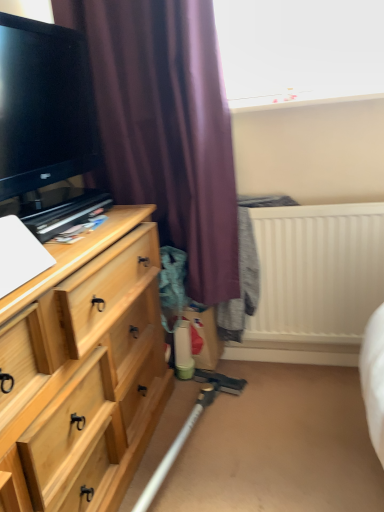
Where is `white plastic radiator at upper right`? white plastic radiator at upper right is located at coordinates (317, 272).

You are a GUI agent. You are given a task and a screenshot of the screen. Output one action in this format:
    pyautogui.click(x=<x>, y=<y>)
    Task: Click on the light wood chest of drawers at left
    The image size is (384, 512).
    Given the screenshot: What is the action you would take?
    pyautogui.click(x=86, y=380)

Identify the location of black glossy tv at left. (44, 106).

Considering the sizes of objects light wood chest of drawers at left and purple matte curtain at upper left in the image provided, who is smaller, light wood chest of drawers at left or purple matte curtain at upper left?

Smaller between the two is purple matte curtain at upper left.

Which object is positioned more to the right, light wood chest of drawers at left or purple matte curtain at upper left?

From the viewer's perspective, purple matte curtain at upper left appears more on the right side.

Is light wood chest of drawers at left positioned behind purple matte curtain at upper left?

That is False.

From the image's perspective, which object appears higher, light wood chest of drawers at left or purple matte curtain at upper left?

purple matte curtain at upper left is shown above in the image.

Considering the relative positions of white plastic radiator at upper right and black glossy tv at left in the image provided, is white plastic radiator at upper right to the right of black glossy tv at left from the viewer's perspective?

Yes, white plastic radiator at upper right is to the right of black glossy tv at left.

Which is in front, white plastic radiator at upper right or black glossy tv at left?

black glossy tv at left is in front.

Considering the relative sizes of white plastic radiator at upper right and black glossy tv at left in the image provided, is white plastic radiator at upper right shorter than black glossy tv at left?

In fact, white plastic radiator at upper right may be taller than black glossy tv at left.

Is white plastic radiator at upper right situated inside black glossy tv at left or outside?

white plastic radiator at upper right cannot be found inside black glossy tv at left.

In terms of size, does black glossy tv at left appear bigger or smaller than white plastic radiator at upper right?

Considering their sizes, black glossy tv at left takes up less space than white plastic radiator at upper right.

From the image's perspective, is black glossy tv at left over white plastic radiator at upper right?

Correct, black glossy tv at left appears higher than white plastic radiator at upper right in the image.

Looking at this image, is black glossy tv at left taller or shorter than white plastic radiator at upper right?

In the image, black glossy tv at left appears to be shorter than white plastic radiator at upper right.

Which object is positioned more to the right, black glossy tv at left or white plastic radiator at upper right?

white plastic radiator at upper right is more to the right.

Is white plastic radiator at upper right inside the boundaries of light wood chest of drawers at left, or outside?

white plastic radiator at upper right is outside light wood chest of drawers at left.

Considering the points (353, 239) and (58, 287), which point is in front, point (353, 239) or point (58, 287)?

The point (58, 287) is more forward.

From a real-world perspective, which is physically below, white plastic radiator at upper right or light wood chest of drawers at left?

light wood chest of drawers at left is physically lower.

The width and height of the screenshot is (384, 512). In order to click on the chest of drawers lying below the white plastic radiator at upper right (from the image's perspective) in this screenshot , I will do `click(86, 380)`.

Which is closer to the camera, (50, 35) or (8, 330)?

Point (50, 35).

From a real-world perspective, between black glossy tv at left and light wood chest of drawers at left, who is vertically lower?

From a 3D spatial view, light wood chest of drawers at left is below.

Can you confirm if black glossy tv at left is taller than light wood chest of drawers at left?

In fact, black glossy tv at left may be shorter than light wood chest of drawers at left.

Where is `television above the light wood chest of drawers at left (from the image's perspective)`? The image size is (384, 512). television above the light wood chest of drawers at left (from the image's perspective) is located at coordinates (44, 106).

Which is farther, (93, 468) or (15, 71)?

Answer: The point (93, 468) is behind.

At what (x,y) coordinates should I click in order to perform the action: click on chest of drawers on the right of the black glossy tv at left. Please return your answer as a coordinate pair (x, y). This screenshot has width=384, height=512. Looking at the image, I should click on (86, 380).

Which is behind, light wood chest of drawers at left or black glossy tv at left?

Positioned behind is black glossy tv at left.

Considering the sizes of purple matte curtain at upper left and light wood chest of drawers at left in the image, is purple matte curtain at upper left taller or shorter than light wood chest of drawers at left?

purple matte curtain at upper left is taller than light wood chest of drawers at left.

From a real-world perspective, is purple matte curtain at upper left located beneath light wood chest of drawers at left?

Actually, purple matte curtain at upper left is physically above light wood chest of drawers at left in the real world.

Does point (177, 67) lie behind point (52, 442)?

Yes.

Find the location of a particular element. Image resolution: width=384 pixels, height=512 pixels. curtain that appears behind the light wood chest of drawers at left is located at coordinates pos(166,126).

The width and height of the screenshot is (384, 512). I want to click on radiator below the black glossy tv at left (from a real-world perspective), so click(x=317, y=272).

Based on their spatial positions, is black glossy tv at left or light wood chest of drawers at left closer to white plastic radiator at upper right?

Based on the image, light wood chest of drawers at left appears to be nearer to white plastic radiator at upper right.

Considering their positions, is purple matte curtain at upper left positioned closer to white plastic radiator at upper right than black glossy tv at left?

purple matte curtain at upper left is closer to white plastic radiator at upper right.

From the image, which object appears to be farther from light wood chest of drawers at left, white plastic radiator at upper right or black glossy tv at left?

white plastic radiator at upper right.

When comparing their distances from purple matte curtain at upper left, does white plastic radiator at upper right or light wood chest of drawers at left seem further?

light wood chest of drawers at left is further to purple matte curtain at upper left.

From the picture: Looking at the image, which one is located further to black glossy tv at left, light wood chest of drawers at left or purple matte curtain at upper left?

light wood chest of drawers at left is further to black glossy tv at left.

When comparing their distances from light wood chest of drawers at left, does white plastic radiator at upper right or purple matte curtain at upper left seem closer?

purple matte curtain at upper left.

Based on their spatial positions, is black glossy tv at left or white plastic radiator at upper right further from purple matte curtain at upper left?

white plastic radiator at upper right is positioned further to the anchor purple matte curtain at upper left.

Considering their positions, is white plastic radiator at upper right positioned closer to purple matte curtain at upper left than black glossy tv at left?

The object closer to purple matte curtain at upper left is black glossy tv at left.

The width and height of the screenshot is (384, 512). Find the location of `curtain between black glossy tv at left and white plastic radiator at upper right`. curtain between black glossy tv at left and white plastic radiator at upper right is located at coordinates (166, 126).

You are a GUI agent. You are given a task and a screenshot of the screen. Output one action in this format:
    pyautogui.click(x=<x>, y=<y>)
    Task: Click on the curtain between black glossy tv at left and light wood chest of drawers at left from top to bottom
    
    Given the screenshot: What is the action you would take?
    pyautogui.click(x=166, y=126)

Find the location of a particular element. The image size is (384, 512). curtain between light wood chest of drawers at left and white plastic radiator at upper right in the horizontal direction is located at coordinates (166, 126).

You are a GUI agent. You are given a task and a screenshot of the screen. Output one action in this format:
    pyautogui.click(x=<x>, y=<y>)
    Task: Click on the chest of drawers between black glossy tv at left and white plastic radiator at upper right
    The image size is (384, 512).
    Given the screenshot: What is the action you would take?
    pyautogui.click(x=86, y=380)